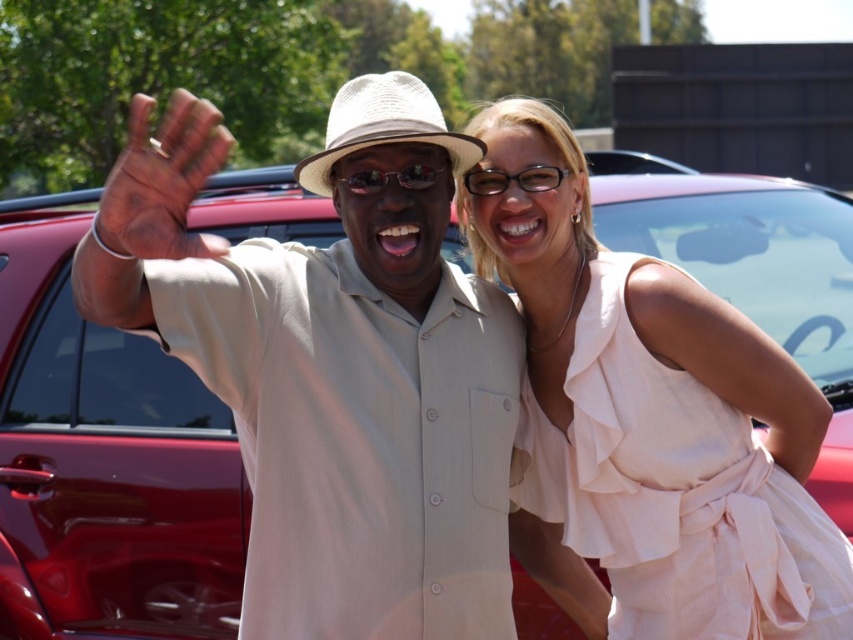
Is metallic red car at center above transparent plastic glasses at upper center?

No.

Is metallic red car at center to the right of transparent plastic glasses at upper center from the viewer's perspective?

No, metallic red car at center is not to the right of transparent plastic glasses at upper center.

Locate an element on the screen. metallic red car at center is located at coordinates tap(105, 461).

This screenshot has height=640, width=853. Identify the location of metallic red car at center. (105, 461).

Does dark skin hand at center have a lesser height compared to sunglasses at center?

Incorrect, dark skin hand at center's height does not fall short of sunglasses at center's.

Which is below, dark skin hand at center or sunglasses at center?

dark skin hand at center

I want to click on dark skin hand at center, so click(161, 182).

What do you see at coordinates (334, 369) in the screenshot? I see `beige matte hat at center` at bounding box center [334, 369].

Can you confirm if beige matte hat at center is wider than peach silk dress at right?

Indeed, beige matte hat at center has a greater width compared to peach silk dress at right.

Is point (440, 621) less distant than point (730, 625)?

Yes, it is in front of point (730, 625).

At what (x,y) coordinates should I click in order to perform the action: click on beige matte hat at center. Please return your answer as a coordinate pair (x, y). Looking at the image, I should click on (334, 369).